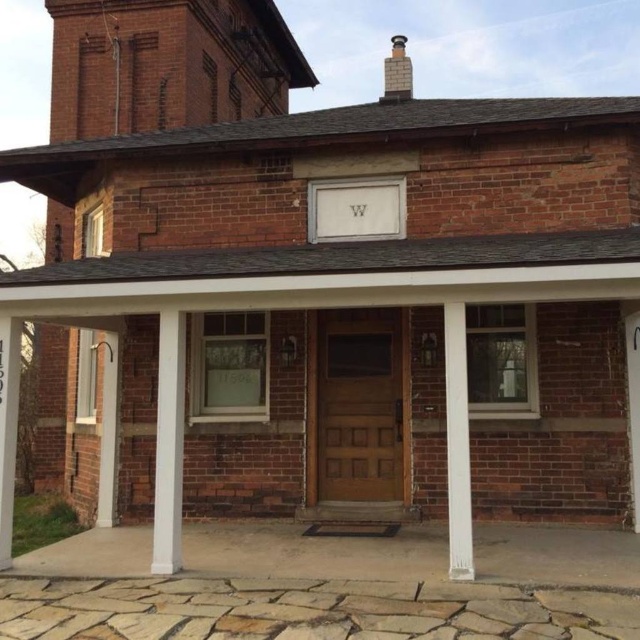
Question: Which of the following is the closest to the observer?

Choices:
 (A) (458, 321)
 (B) (164, 556)
 (C) (397, 76)

Answer: (A)

Question: Which object is closer to the camera taking this photo?

Choices:
 (A) white smooth column at center
 (B) brick chimney at upper center

Answer: (A)

Question: Which point appears closest to the camera in this image?

Choices:
 (A) coord(173,522)
 (B) coord(451,470)
 (C) coord(392,68)

Answer: (B)

Question: Where is white smooth column at center located in relation to white painted wood pillar at center in the image?

Choices:
 (A) above
 (B) below

Answer: (B)

Question: Does white painted wood pillar at center have a larger size compared to brick chimney at upper center?

Choices:
 (A) yes
 (B) no

Answer: (B)

Question: Can you confirm if white smooth column at center is smaller than brick chimney at upper center?

Choices:
 (A) no
 (B) yes

Answer: (B)